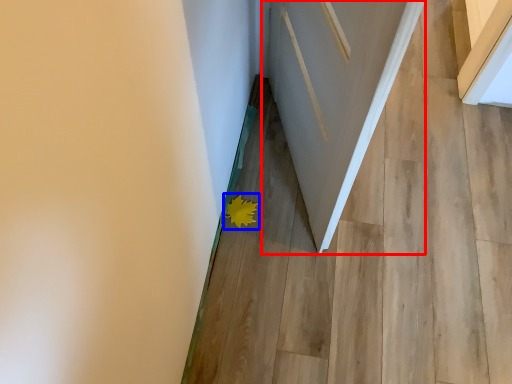
Question: Which object is further to the camera taking this photo, door (highlighted by a red box) or flower (highlighted by a blue box)?

Choices:
 (A) door
 (B) flower

Answer: (B)